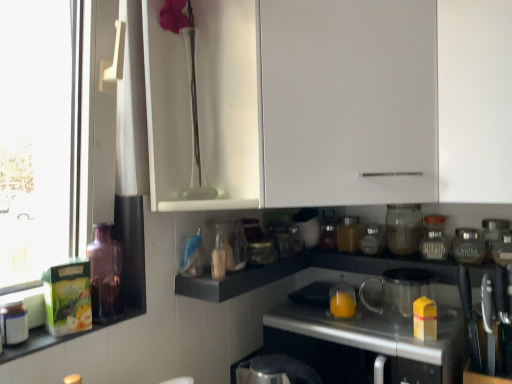
Identify the location of vacant area that lies between matte glass jar at center-right, which appears as the second bottle when viewed from the right, and clear glass jar at right, the fourth bottle positioned from the back. (402, 256).